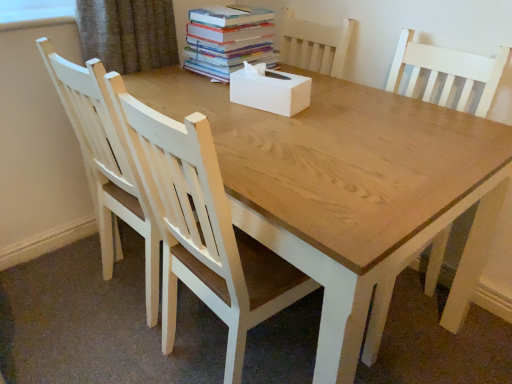
This screenshot has width=512, height=384. What are the coordinates of `vacant area to the right of white matte tissue box at center` in the screenshot? It's located at (334, 107).